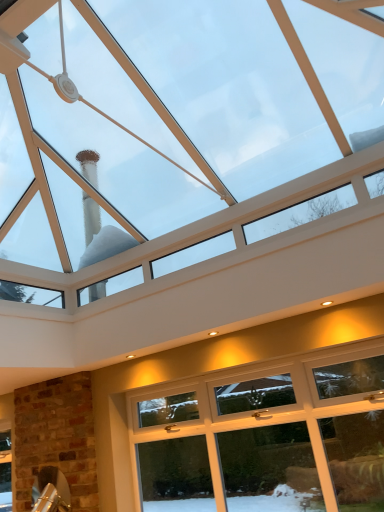
This screenshot has height=512, width=384. What do you see at coordinates (237, 92) in the screenshot?
I see `transparent glass window at upper center` at bounding box center [237, 92].

Measure the distance between transparent glass window at upper center and camera.

A distance of 1.87 meters exists between transparent glass window at upper center and camera.

This screenshot has width=384, height=512. Find the location of `transparent glass window at upper center`. transparent glass window at upper center is located at coordinates (237, 92).

Identify the location of transparent glass window at upper center. Image resolution: width=384 pixels, height=512 pixels. (237, 92).